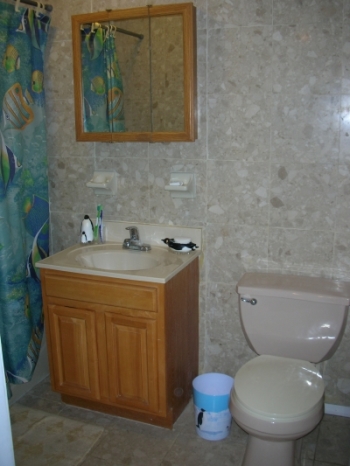
You are a GUI agent. You are given a task and a screenshot of the screen. Output one action in this format:
    pyautogui.click(x=<x>, y=<y>)
    Task: Click on the toilet lid
    
    Given the screenshot: What is the action you would take?
    pyautogui.click(x=277, y=395)